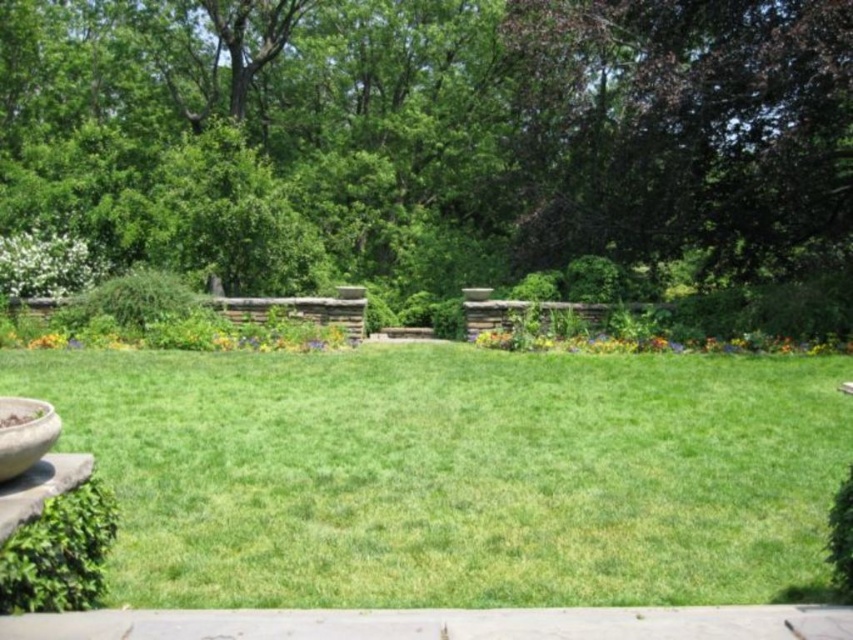
Does green leafy tree at center appear under green grass at center?

No.

Who is higher up, green leafy tree at center or green grass at center?

green leafy tree at center is higher up.

Is point (733, 228) farther from camera compared to point (691, 525)?

That is True.

You are a GUI agent. You are given a task and a screenshot of the screen. Output one action in this format:
    pyautogui.click(x=<x>, y=<y>)
    Task: Click on the green leafy tree at center
    
    Given the screenshot: What is the action you would take?
    (433, 134)

Between green leafy tree at center and matte concrete bowl at lower left, which one appears on the right side from the viewer's perspective?

From the viewer's perspective, green leafy tree at center appears more on the right side.

Who is lower down, green leafy tree at center or matte concrete bowl at lower left?

matte concrete bowl at lower left

Is point (730, 184) in front of point (35, 429)?

No, it is behind (35, 429).

Identify the location of green leafy tree at center. This screenshot has height=640, width=853. (433, 134).

Does green grass at center have a smaller size compared to matte concrete bowl at lower left?

No, green grass at center is not smaller than matte concrete bowl at lower left.

This screenshot has width=853, height=640. Describe the element at coordinates (456, 474) in the screenshot. I see `green grass at center` at that location.

Find the location of `green grass at center`. green grass at center is located at coordinates (456, 474).